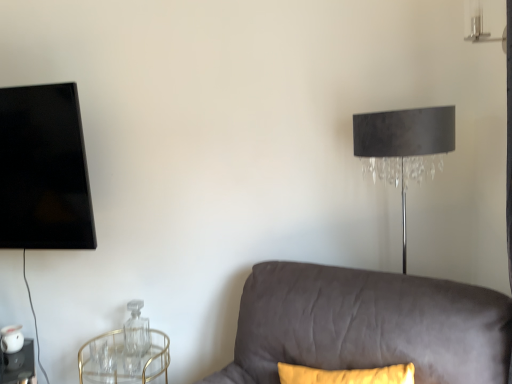
Measure the distance between point (149, 342) and camera.

The depth of point (149, 342) is 2.06 meters.

At what (x,y) coordinates should I click in order to perform the action: click on clear glass table at lower left. Please return your answer as a coordinate pair (x, y). Looking at the image, I should click on (x=18, y=365).

What are the coordinates of `matte black lampshade at upper right` in the screenshot? It's located at (404, 147).

What do you see at coordinates (404, 147) in the screenshot? I see `matte black lampshade at upper right` at bounding box center [404, 147].

Locate an element on the screen. The width and height of the screenshot is (512, 384). transparent glass bottle at lower left is located at coordinates (136, 330).

Relative to clear glass table at lower left, is transparent glass bottle at lower left in front or behind?

Visually, transparent glass bottle at lower left is located behind clear glass table at lower left.

Is transparent glass bottle at lower left next to clear glass table at lower left?

No, transparent glass bottle at lower left is not next to clear glass table at lower left.

From the image's perspective, is transparent glass bottle at lower left located beneath clear glass table at lower left?

Actually, transparent glass bottle at lower left appears above clear glass table at lower left in the image.

How many degrees apart are the facing directions of suede gray couch at lower right and transparent glass bottle at lower left?

There is a 24.4-degree angle between the facing directions of suede gray couch at lower right and transparent glass bottle at lower left.

Is suede gray couch at lower right oriented towards transparent glass bottle at lower left?

No, suede gray couch at lower right is not aimed at transparent glass bottle at lower left.

From the image's perspective, which one is positioned higher, suede gray couch at lower right or transparent glass bottle at lower left?

suede gray couch at lower right.

Considering the relative sizes of suede gray couch at lower right and transparent glass bottle at lower left in the image provided, is suede gray couch at lower right thinner than transparent glass bottle at lower left?

No.

Does clear glass table at lower left turn towards suede gray couch at lower right?

No, clear glass table at lower left is not facing towards suede gray couch at lower right.

From the image's perspective, between clear glass table at lower left and suede gray couch at lower right, who is located below?

clear glass table at lower left.

Who is smaller, clear glass table at lower left or suede gray couch at lower right?

clear glass table at lower left is smaller.

Consider the image. Is clear glass table at lower left outside of suede gray couch at lower right?

Yes, clear glass table at lower left is outside of suede gray couch at lower right.

Is point (118, 369) farther from camera compared to point (17, 367)?

No, (118, 369) is in front of (17, 367).

Can you see gold metallic round table at lower left touching clear glass table at lower left?

gold metallic round table at lower left is not next to clear glass table at lower left, and they're not touching.

Who is shorter, transparent glass bottle at lower left or matte black lampshade at upper right?

With less height is transparent glass bottle at lower left.

In the image, is transparent glass bottle at lower left positioned in front of or behind matte black lampshade at upper right?

Clearly, transparent glass bottle at lower left is behind matte black lampshade at upper right.

Would you say transparent glass bottle at lower left is a long distance from matte black lampshade at upper right?

That's right, there is a large distance between transparent glass bottle at lower left and matte black lampshade at upper right.

Considering the relative sizes of clear glass table at lower left and matte black lampshade at upper right in the image provided, is clear glass table at lower left shorter than matte black lampshade at upper right?

Yes, clear glass table at lower left is shorter than matte black lampshade at upper right.

From a real-world perspective, is clear glass table at lower left below matte black lampshade at upper right?

Yes, from a real-world perspective, clear glass table at lower left is under matte black lampshade at upper right.

Is clear glass table at lower left behind matte black lampshade at upper right?

Yes, clear glass table at lower left is further from the viewer.

From the image's perspective, is clear glass table at lower left located beneath matte black lampshade at upper right?

Correct, clear glass table at lower left appears lower than matte black lampshade at upper right in the image.

Can you see transparent glass bottle at lower left touching suede gray couch at lower right?

No, transparent glass bottle at lower left is not touching suede gray couch at lower right.

Which is farther, (147, 350) or (409, 310)?

Positioned behind is point (147, 350).

From a real-world perspective, does transparent glass bottle at lower left sit lower than suede gray couch at lower right?

Yes, from a real-world perspective, transparent glass bottle at lower left is beneath suede gray couch at lower right.

From the image's perspective, would you say transparent glass bottle at lower left is shown under suede gray couch at lower right?

Indeed, from the image's perspective, transparent glass bottle at lower left is shown beneath suede gray couch at lower right.

Find the location of `table that is below the transparent glass bottle at lower left (from the image's perspective)`. table that is below the transparent glass bottle at lower left (from the image's perspective) is located at coordinates (18, 365).

The image size is (512, 384). Find the location of `studio couch that is on the right side of transparent glass bottle at lower left`. studio couch that is on the right side of transparent glass bottle at lower left is located at coordinates (367, 325).

Based on their spatial positions, is gold metallic round table at lower left or clear glass table at lower left closer to suede gray couch at lower right?

gold metallic round table at lower left is closer to suede gray couch at lower right.

Estimate the real-world distances between objects in this image. Which object is closer to clear glass table at lower left, gold metallic round table at lower left or matte black lampshade at upper right?

gold metallic round table at lower left is positioned closer to the anchor clear glass table at lower left.

Looking at the image, which one is located further to matte black lampshade at upper right, gold metallic round table at lower left or transparent glass bottle at lower left?

The object further to matte black lampshade at upper right is gold metallic round table at lower left.

Considering their positions, is matte black lampshade at upper right positioned further to clear glass table at lower left than gold metallic round table at lower left?

Among the two, matte black lampshade at upper right is located further to clear glass table at lower left.

When comparing their distances from clear glass table at lower left, does suede gray couch at lower right or gold metallic round table at lower left seem closer?

Among the two, gold metallic round table at lower left is located nearer to clear glass table at lower left.

Based on their spatial positions, is clear glass table at lower left or matte black lampshade at upper right further from suede gray couch at lower right?

clear glass table at lower left is further to suede gray couch at lower right.

Looking at this image, considering their positions, is clear glass table at lower left positioned closer to matte black lampshade at upper right than suede gray couch at lower right?

Among the two, suede gray couch at lower right is located nearer to matte black lampshade at upper right.

From the image, which object appears to be farther from matte black lampshade at upper right, suede gray couch at lower right or clear glass table at lower left?

The object further to matte black lampshade at upper right is clear glass table at lower left.

Locate an element on the screen. The width and height of the screenshot is (512, 384). round table between suede gray couch at lower right and transparent glass bottle at lower left along the z-axis is located at coordinates (123, 360).

Find the location of a particular element. studio couch situated between gold metallic round table at lower left and matte black lampshade at upper right from left to right is located at coordinates (367, 325).

The height and width of the screenshot is (384, 512). I want to click on lamp between suede gray couch at lower right and transparent glass bottle at lower left from front to back, so pos(404,147).

Identify the location of round table between clear glass table at lower left and matte black lampshade at upper right. (123, 360).